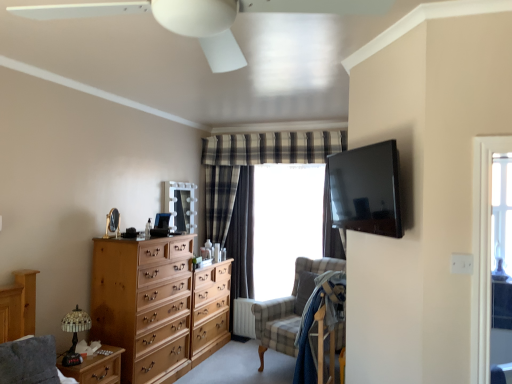
Question: Would you say white plastic ceiling fan at upper center is to the left or to the right of white textured radiator at lower center in the picture?

Choices:
 (A) right
 (B) left

Answer: (B)

Question: From a real-world perspective, is white plastic ceiling fan at upper center physically located above or below white textured radiator at lower center?

Choices:
 (A) below
 (B) above

Answer: (B)

Question: Based on their relative distances, which object is nearer to the matte black tv at upper right?

Choices:
 (A) wooden nightstand at lower left
 (B) transparent glass window at center
 (C) white plastic ceiling fan at upper center
 (D) white textured radiator at lower center
 (E) light brown wooden chest of drawers at left

Answer: (C)

Question: Which is nearer to the matte black tv at upper right?

Choices:
 (A) light brown wooden chest of drawers at left
 (B) white plastic ceiling fan at upper center
 (C) wooden nightstand at lower left
 (D) checkered fabric swivel chair at center
 (E) transparent glass window at center

Answer: (B)